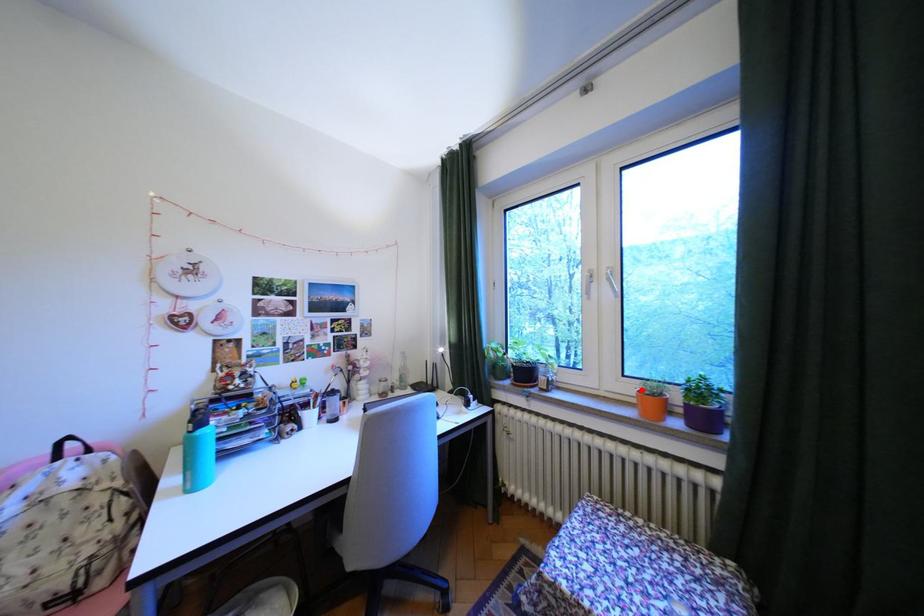
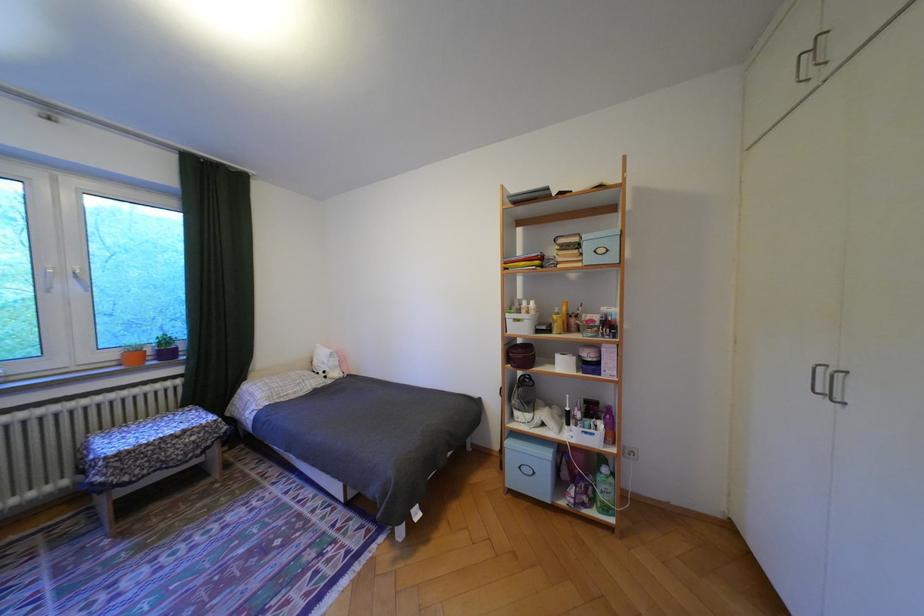
Locate, in the second image, the point that corresponds to the highlighted location in the first image.

(124, 355)